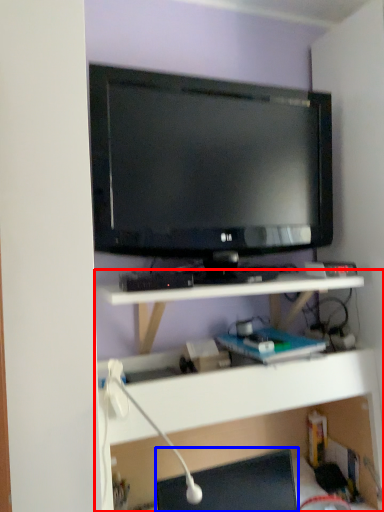
Question: Which point is closer to the camera, shelf (highlighted by a red box) or desktop (highlighted by a blue box)?

Choices:
 (A) shelf
 (B) desktop

Answer: (A)